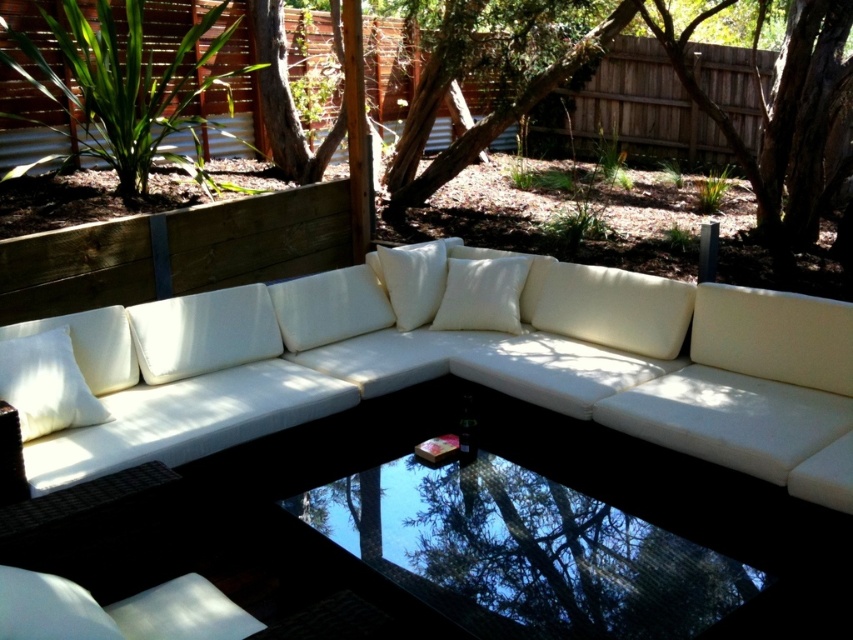
What do you see at coordinates (486, 371) in the screenshot?
I see `white fabric couch at center` at bounding box center [486, 371].

I want to click on white fabric couch at center, so click(x=486, y=371).

What are the coordinates of `white fabric couch at center` in the screenshot? It's located at (486, 371).

Find the location of `white fabric couch at center`. white fabric couch at center is located at coordinates (486, 371).

Does white fabric couch at center appear on the left side of white soft cushion at center?

No, white fabric couch at center is not to the left of white soft cushion at center.

In the scene shown: Between white fabric couch at center and white soft cushion at center, which one is positioned higher?

white soft cushion at center is above.

Is point (334, 352) positioned after point (383, 276)?

No, it is in front of (383, 276).

Identify the location of white fabric couch at center. The image size is (853, 640). (486, 371).

Can you confirm if white matte pillow at left is wider than white fabric pillow at center?

Incorrect, white matte pillow at left's width does not surpass white fabric pillow at center's.

Which is behind, point (80, 376) or point (450, 323)?

The point (450, 323) is more distant.

Is point (32, 381) positioned before point (490, 308)?

That is True.

Image resolution: width=853 pixels, height=640 pixels. Identify the location of white matte pillow at left. (45, 385).